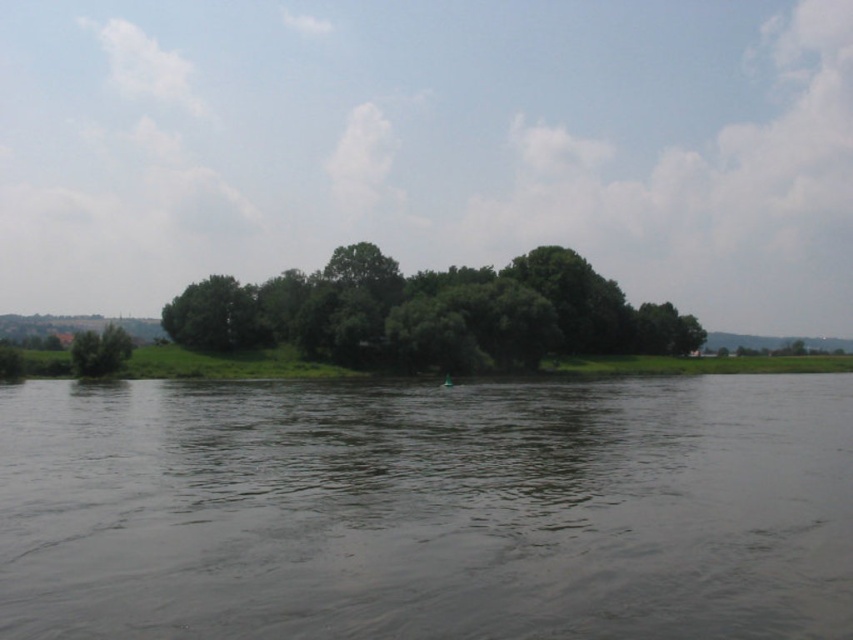
Question: Which object is positioned closest to the green leafy trees at center?

Choices:
 (A) brown murky water at center
 (B) green leafy tree at left

Answer: (B)

Question: Does brown murky water at center appear over green leafy tree at left?

Choices:
 (A) no
 (B) yes

Answer: (A)

Question: From the image, what is the correct spatial relationship of green leafy trees at center in relation to green leafy tree at left?

Choices:
 (A) left
 (B) right

Answer: (B)

Question: Among these objects, which one is nearest to the camera?

Choices:
 (A) green leafy trees at center
 (B) green leafy tree at left
 (C) brown murky water at center

Answer: (C)

Question: Can you confirm if brown murky water at center is smaller than green leafy trees at center?

Choices:
 (A) yes
 (B) no

Answer: (A)

Question: Which point is closer to the camera?

Choices:
 (A) (378, 538)
 (B) (265, 320)
 (C) (90, 348)

Answer: (A)